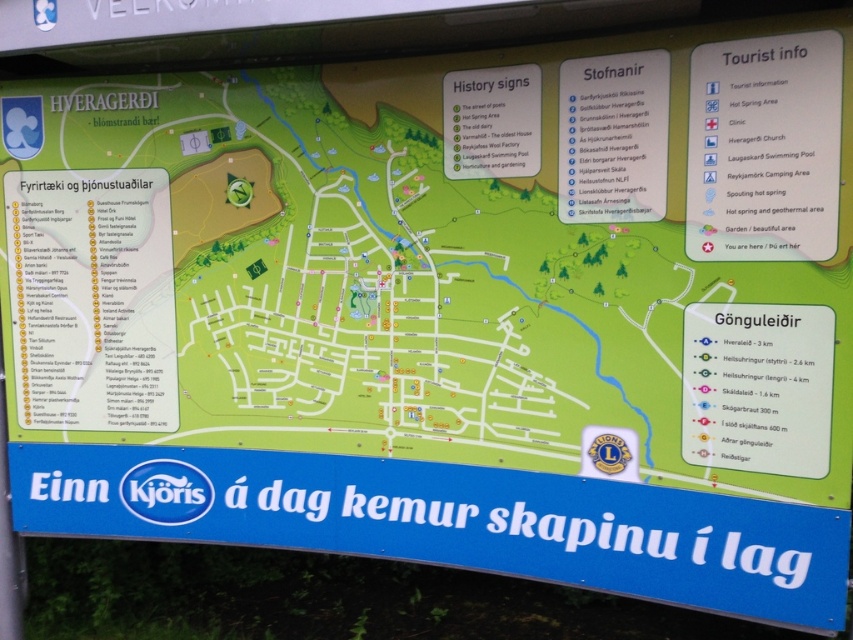
Question: In this image, where is white paper at upper right located relative to white paper sign at upper center?

Choices:
 (A) above
 (B) below

Answer: (B)

Question: Is white paper sign at upper center below green paper history signs at upper center?

Choices:
 (A) no
 (B) yes

Answer: (B)

Question: Which of these objects is positioned closest to the white paper at upper right?

Choices:
 (A) green paper history signs at upper center
 (B) white paper sign at upper center

Answer: (B)

Question: Which of these objects is positioned closest to the green paper history signs at upper center?

Choices:
 (A) white paper sign at upper center
 (B) white paper at upper right

Answer: (A)

Question: Among these points, which one is nearest to the camera?

Choices:
 (A) (737, 97)
 (B) (456, 176)

Answer: (A)

Question: Where is white paper sign at upper center located in relation to green paper history signs at upper center in the image?

Choices:
 (A) right
 (B) left

Answer: (A)